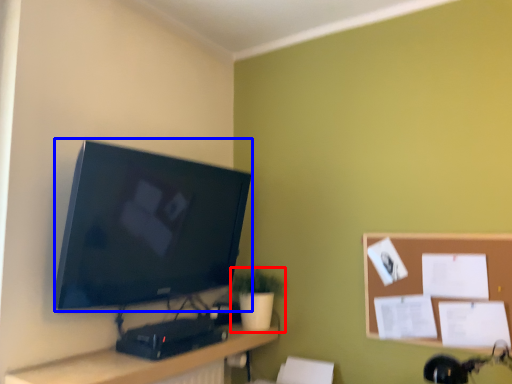
Question: Which object appears closest to the camera in this image, houseplant (highlighted by a red box) or television (highlighted by a blue box)?

Choices:
 (A) houseplant
 (B) television

Answer: (B)